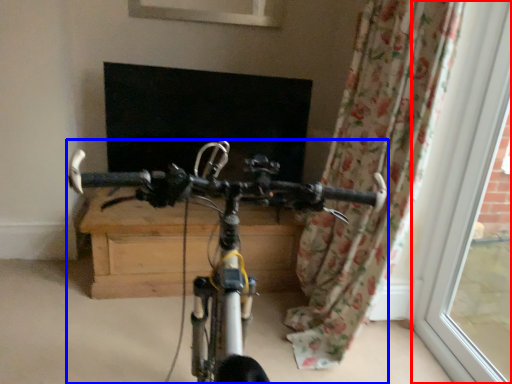
Question: Which of the following is the farthest to the observer, window frame (highlighted by a red box) or bicycle (highlighted by a blue box)?

Choices:
 (A) window frame
 (B) bicycle

Answer: (A)